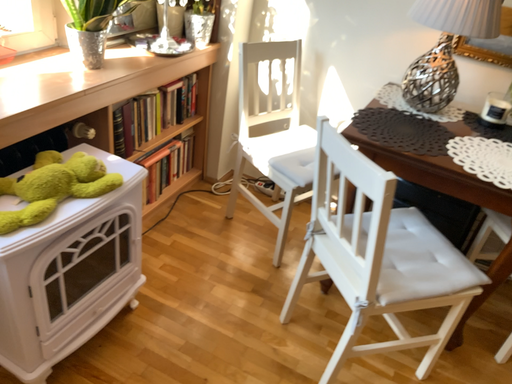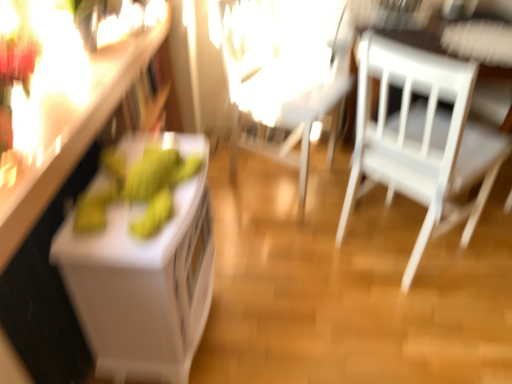
Question: Which way did the camera rotate in the video?

Choices:
 (A) rotated left
 (B) rotated right

Answer: (B)